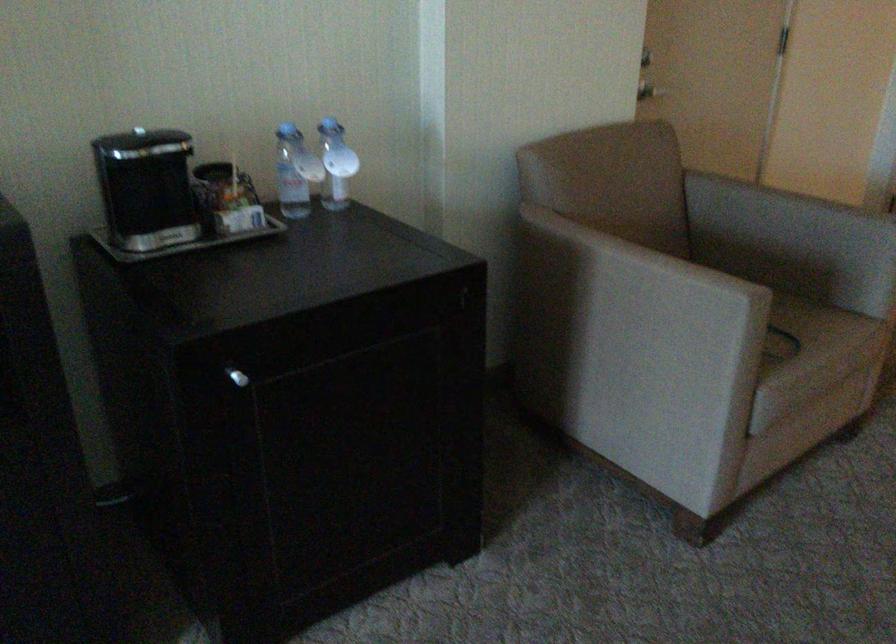
Where is `chair sitting surface`? Image resolution: width=896 pixels, height=644 pixels. chair sitting surface is located at coordinates (811, 335).